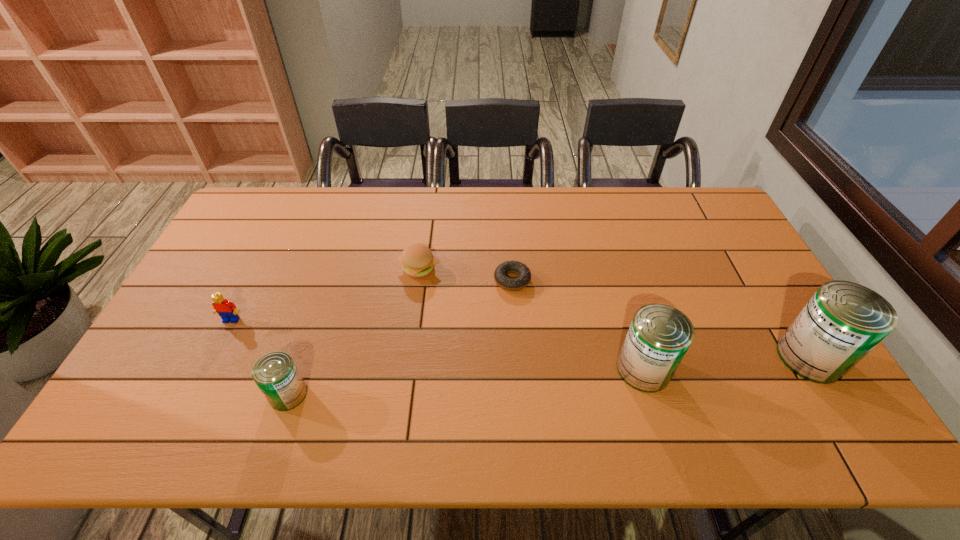
At what (x,y) coordinates should I click in order to perform the action: click on the shortest can. Please return your answer as a coordinate pair (x, y). The height and width of the screenshot is (540, 960). Looking at the image, I should click on (275, 373).

Identify the location of the leftmost can. (275, 373).

Where is `the second tallest can`? The height and width of the screenshot is (540, 960). the second tallest can is located at coordinates (659, 336).

Where is `the fifth object from left to right`? the fifth object from left to right is located at coordinates (659, 336).

Identify the location of the rightmost object. (843, 321).

Locate an element on the screen. the second shortest object is located at coordinates (417, 259).

Locate an element on the screen. This screenshot has width=960, height=540. the third object from left to right is located at coordinates (417, 259).

Locate an element on the screen. The height and width of the screenshot is (540, 960). the fourth nearest object is located at coordinates (227, 310).

Where is `Lego`? The width and height of the screenshot is (960, 540). Lego is located at coordinates (227, 310).

This screenshot has height=540, width=960. I want to click on the shortest object, so click(524, 275).